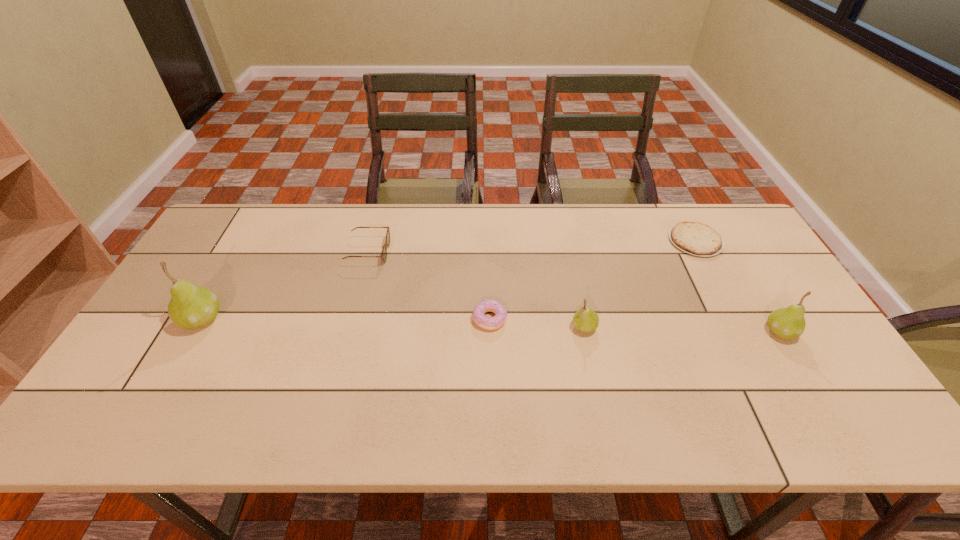
Locate an element on the screen. object that stands as the second closest to the rightmost pear is located at coordinates (585, 320).

Choose which pear is the nearest neighbor to the third object from right to left. Please provide its 2D coordinates. Your answer should be formatted as a tuple, i.e. [(x, y)], where the tuple contains the x and y coordinates of a point satisfying the conditions above.

[(787, 323)]

Locate an element on the screen. The image size is (960, 540). pear that is the closest to the fifth object from right to left is located at coordinates (191, 306).

Where is `vacant area in the image that satisfies the following two spatial constraints: 1. at the front view of the shortest pear; 2. on the left side of the second object from left to right`? The width and height of the screenshot is (960, 540). vacant area in the image that satisfies the following two spatial constraints: 1. at the front view of the shortest pear; 2. on the left side of the second object from left to right is located at coordinates (348, 327).

Where is `vacant space that satisfies the following two spatial constraints: 1. at the front view of the fourth tallest object; 2. on the left side of the doughnut`? vacant space that satisfies the following two spatial constraints: 1. at the front view of the fourth tallest object; 2. on the left side of the doughnut is located at coordinates (350, 319).

In order to click on vacant point that satisfies the following two spatial constraints: 1. at the front view of the rightmost pear; 2. on the left side of the fourth tallest object in this screenshot , I will do `click(348, 332)`.

This screenshot has height=540, width=960. In order to click on vacant space that satisfies the following two spatial constraints: 1. at the front view of the spectacles; 2. on the left side of the second shortest pear in this screenshot , I will do coord(348,332).

This screenshot has width=960, height=540. I want to click on free location that satisfies the following two spatial constraints: 1. at the front view of the fifth shortest object; 2. on the left side of the third shortest object, so click(x=348, y=332).